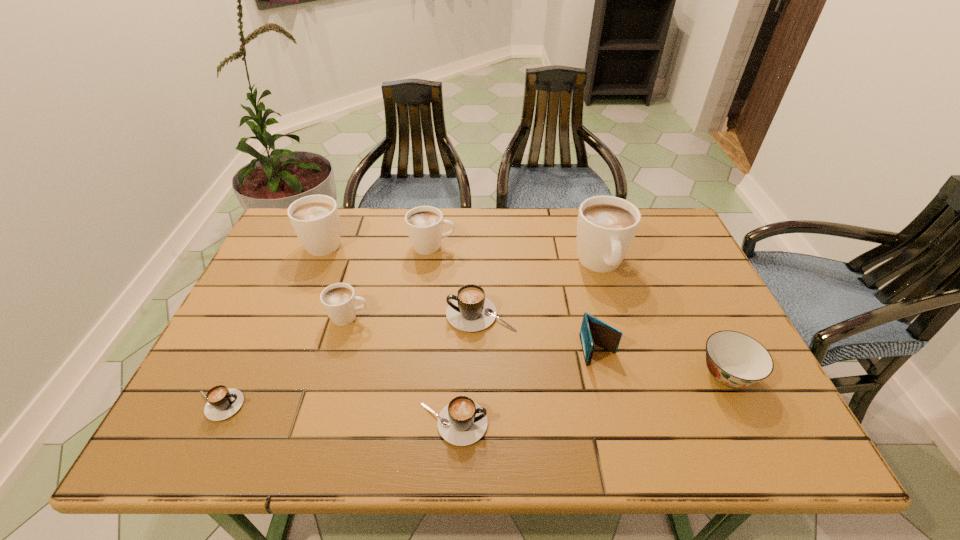
Identify the location of the rightmost white cappuccino. (606, 226).

Where is `the rightmost cappuccino`? This screenshot has height=540, width=960. the rightmost cappuccino is located at coordinates (606, 226).

You are a GUI agent. You are given a task and a screenshot of the screen. Output one action in this format:
    pyautogui.click(x=<x>, y=<y>)
    Task: Click on the second tallest object
    This screenshot has width=960, height=540.
    Given the screenshot: What is the action you would take?
    pyautogui.click(x=315, y=219)

Image resolution: width=960 pixels, height=540 pixels. I want to click on the second biggest white cappuccino, so click(315, 219).

I want to click on the third biggest white cappuccino, so click(424, 224).

Locate an element on the screen. The width and height of the screenshot is (960, 540). the second white cappuccino from right to left is located at coordinates pos(424,224).

The width and height of the screenshot is (960, 540). Find the location of `the smallest white cappuccino`. the smallest white cappuccino is located at coordinates (339, 301).

You are a GUI agent. You are given a task and a screenshot of the screen. Output one action in this format:
    pyautogui.click(x=<x>, y=<y>)
    Task: Click on the third white cappuccino from right to left
    Image resolution: width=960 pixels, height=540 pixels.
    Given the screenshot: What is the action you would take?
    pyautogui.click(x=339, y=301)

Find the location of a particular element. This screenshot has width=960, height=540. blue wallet is located at coordinates (593, 331).

Where is `the biggest black cappuccino`? The width and height of the screenshot is (960, 540). the biggest black cappuccino is located at coordinates (470, 310).